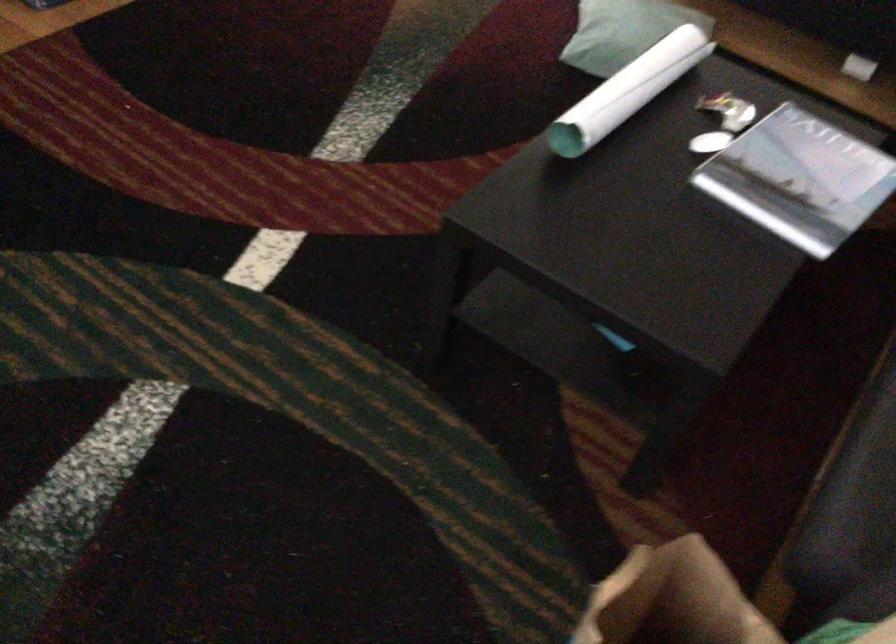
The location [798,178] corresponds to which object?

It refers to a magazine on table.